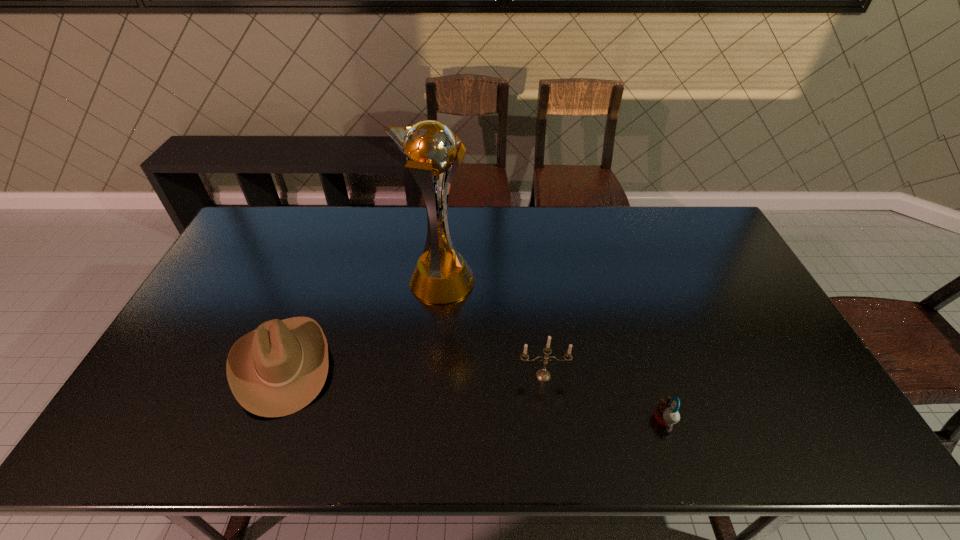
The height and width of the screenshot is (540, 960). I want to click on vacant space located on the front of the second shortest object, so click(253, 438).

Image resolution: width=960 pixels, height=540 pixels. In order to click on vacant region located 0.330m on the front-facing side of the shortest object in this screenshot , I will do `click(517, 420)`.

You are a GUI agent. You are given a task and a screenshot of the screen. Output one action in this format:
    pyautogui.click(x=<x>, y=<y>)
    Task: Click on the vacant space situated 0.160m on the front-facing side of the shortest object
    The image size is (960, 540).
    Given the screenshot: What is the action you would take?
    pyautogui.click(x=588, y=420)

Locate an element on the screen. free space located 0.280m on the front-facing side of the shortest object is located at coordinates (539, 420).

This screenshot has height=540, width=960. Identify the location of object present at the near edge. [666, 414].

This screenshot has height=540, width=960. I want to click on vacant region at the far edge of the desktop, so click(x=665, y=223).

In the image, there is a desktop. Identify the location of vacant space at the near edge. The width and height of the screenshot is (960, 540). (404, 431).

Where is `free space at the right edge`? free space at the right edge is located at coordinates click(x=741, y=334).

In the image, there is a desktop. Where is `vacant region at the far left corner`? This screenshot has width=960, height=540. vacant region at the far left corner is located at coordinates pyautogui.click(x=269, y=214).

At what (x,y) coordinates should I click in order to perform the action: click on blank area at the near left corner. Please return your answer as a coordinate pair (x, y). This screenshot has width=960, height=540. Looking at the image, I should click on (138, 443).